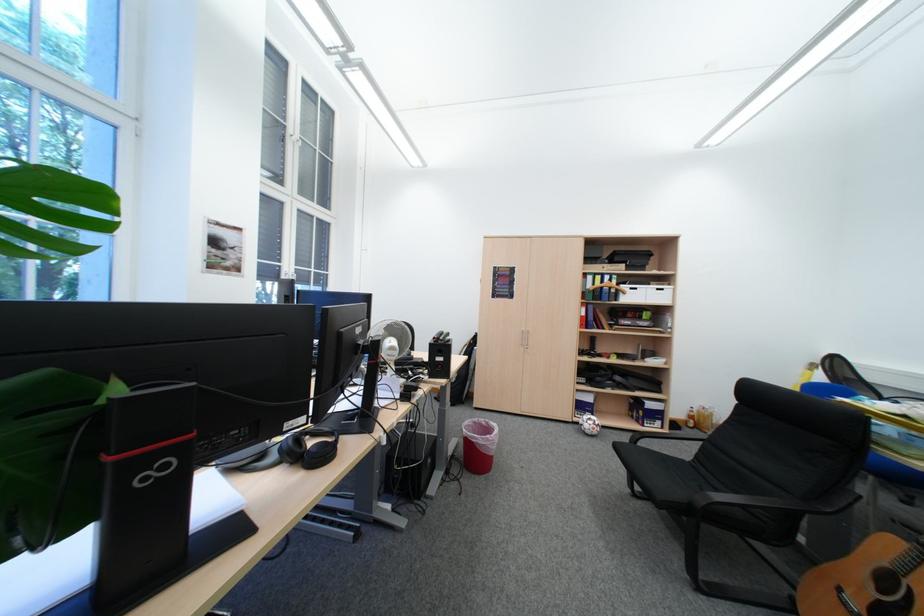
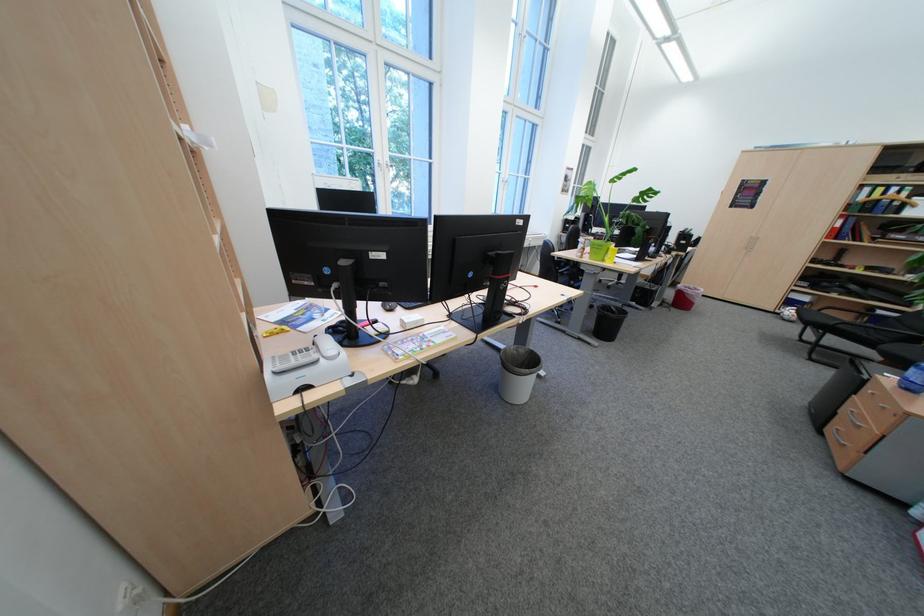
The point at (x=650, y=402) is marked in the first image. Where is the corresponding point in the second image?

(881, 310)